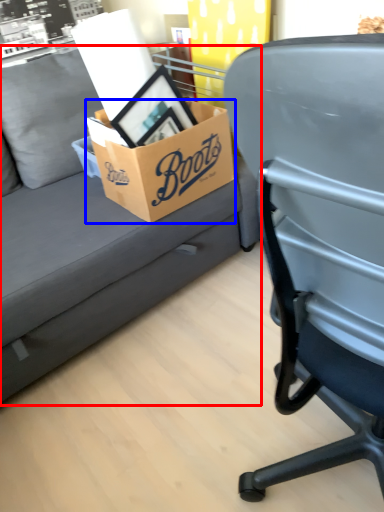
Question: Which object appears farthest to the camera in this image, studio couch (highlighted by a red box) or box (highlighted by a blue box)?

Choices:
 (A) studio couch
 (B) box

Answer: (B)